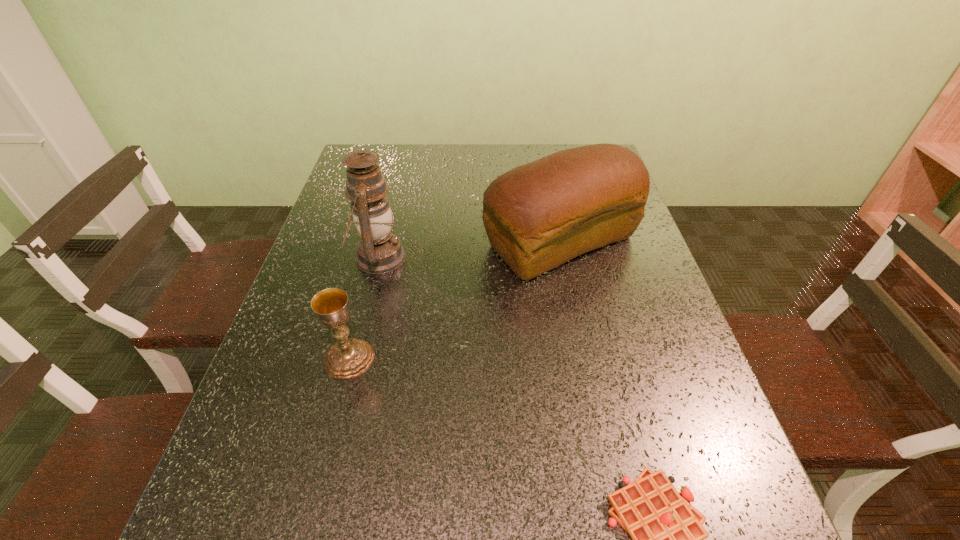
Locate an element on the screen. This screenshot has width=960, height=540. free space at the far edge is located at coordinates (488, 172).

Where is `vacant space at the near edge of the desktop`? vacant space at the near edge of the desktop is located at coordinates (394, 526).

This screenshot has width=960, height=540. In the image, there is a desktop. Identify the location of vacant space at the left edge. (340, 195).

Find the location of a particular element. The height and width of the screenshot is (540, 960). vacant position at the right edge of the desktop is located at coordinates (702, 469).

Locate an element on the screen. The height and width of the screenshot is (540, 960). free space at the far right corner of the desktop is located at coordinates (560, 148).

The width and height of the screenshot is (960, 540). What are the coordinates of `free space between the second shortest object and the bread` in the screenshot? It's located at (455, 300).

The image size is (960, 540). What are the coordinates of `empty space that is in between the bread and the oil lamp` in the screenshot? It's located at (469, 249).

Where is `empty space between the third shortest object and the second shortest object`? The width and height of the screenshot is (960, 540). empty space between the third shortest object and the second shortest object is located at coordinates (455, 300).

I want to click on free area in between the tallest object and the chalice, so click(364, 308).

Where is `vacant point located between the third shortest object and the second shortest object`? The width and height of the screenshot is (960, 540). vacant point located between the third shortest object and the second shortest object is located at coordinates (455, 300).